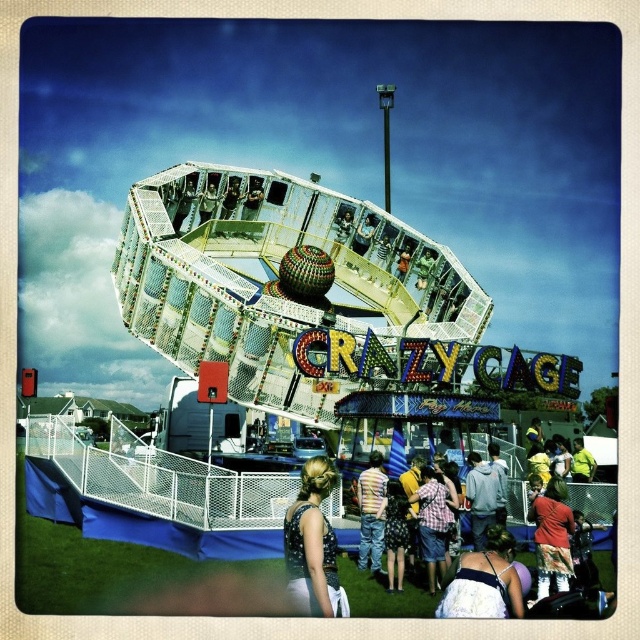
You are at the fairground and see a white lace dress at center and a matte gray hoodie at center. Which clothing item is closer to you?

The white lace dress at center is closer to you because it is in front of the matte gray hoodie at center.

You are standing at the entrance of the amusement park and see both the white lace dress at center and the matte gray hoodie at center. You need to walk to the nearest one. Which one should you walk towards?

The white lace dress at center is 9.74 meters away from the matte gray hoodie at center. Therefore, you should walk towards whichever is closer to your current position. However, since the distance between them is given, but your position isn

You are standing at the entrance of the Crazy Cage ride and want to walk towards the point that is closer to you. Which point should you head towards, point (216, 216) or point (506, 563)?

You should head towards point (216, 216) because it is closer to you than point (506, 563).